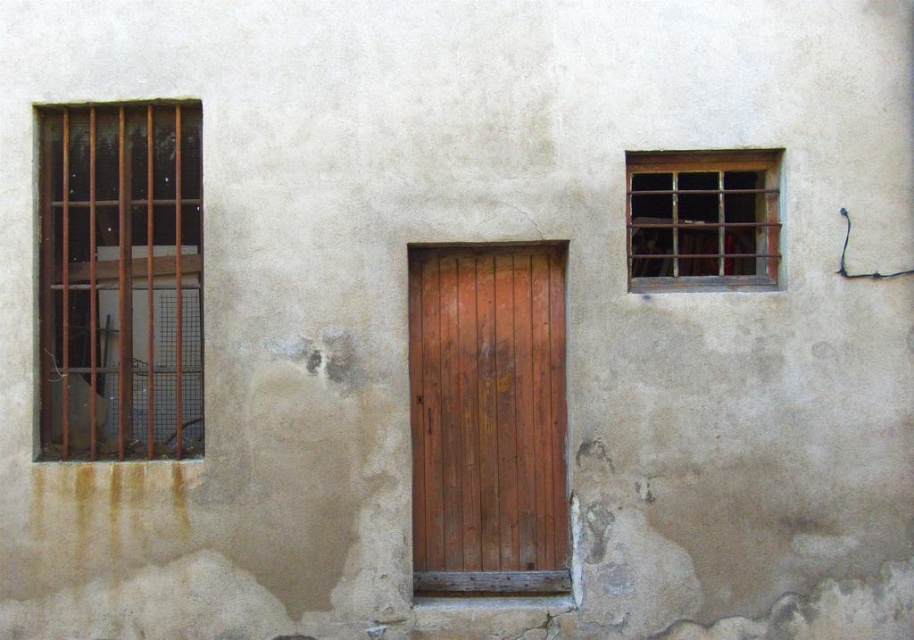
You are standing in front of the old building and want to touch the brown wooden bars at left and the rusty metal bars at upper right. Which one can you reach without moving your position?

The brown wooden bars at left can be reached without moving because they are closer to you than the rusty metal bars at upper right.

You are a painter trying to paint the brown wooden bars at left and the weathered wood door at center. You have a ladder that is 1.5 meters long. If you place the ladder at the base of the wall, can you reach both objects without moving the ladder?

The distance between the brown wooden bars at left and the weathered wood door at center is 1.25 meters. Since the ladder is 1.5 meters long, which is longer than the distance between them, you can position the ladder so that it reaches both objects without moving it.

You are standing in front of an old building and want to enter through the weathered wood door at center. There are rusty metal bars at upper right above the door. Which object is closer to you as you approach the building?

The weathered wood door at center is closer to you than the rusty metal bars at upper right as you approach the building.